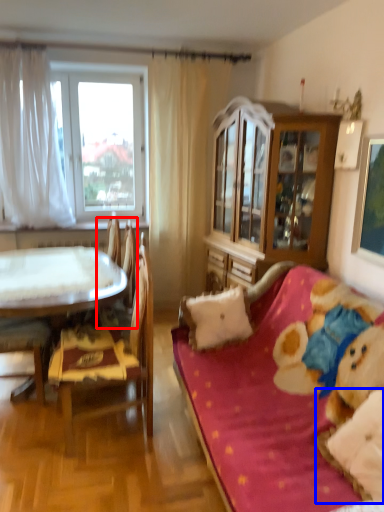
Question: Which point is further to the camera, armchair (highlighted by a red box) or pillow (highlighted by a blue box)?

Choices:
 (A) armchair
 (B) pillow

Answer: (A)